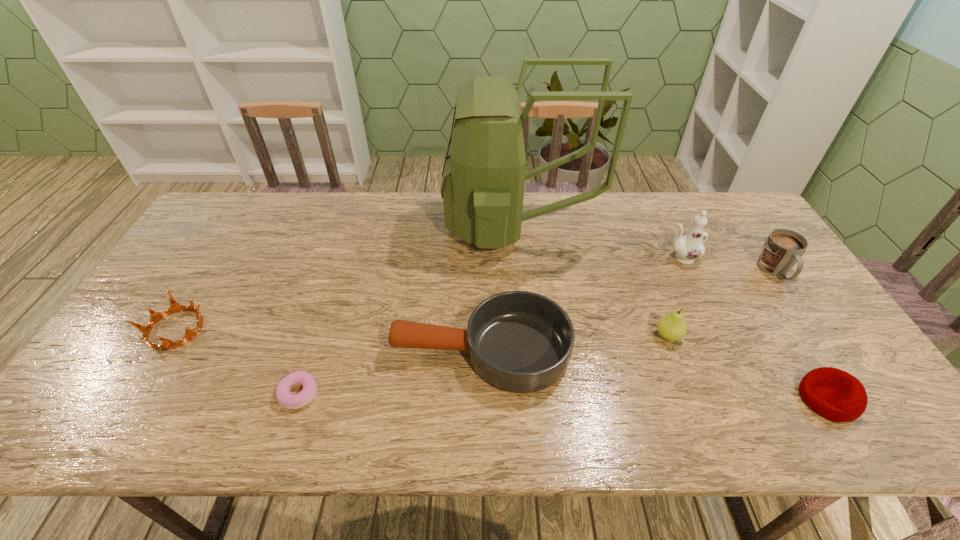
This screenshot has width=960, height=540. What are the coordinates of `mug present at the right edge` in the screenshot? It's located at (783, 248).

This screenshot has height=540, width=960. Find the location of `beanbag that is at the right edge`. beanbag that is at the right edge is located at coordinates click(836, 395).

The width and height of the screenshot is (960, 540). What are the coordinates of `object at the near right corner` in the screenshot? It's located at (836, 395).

This screenshot has height=540, width=960. Identify the location of vacant space at the far edge. (x=663, y=226).

Find the location of `blank space at the near edge of the desktop`. blank space at the near edge of the desktop is located at coordinates (336, 408).

Where is `free space at the left edge of the desktop`? Image resolution: width=960 pixels, height=540 pixels. free space at the left edge of the desktop is located at coordinates (167, 295).

In the image, there is a desktop. In order to click on vacant space at the far left corner in this screenshot , I will do `click(269, 192)`.

Locate an element on the screen. free space between the beanbag and the shortest object is located at coordinates (564, 396).

Identify the location of free space that is in between the pastry and the beanbag. (564, 396).

Locate an element on the screen. The width and height of the screenshot is (960, 540). free space between the tallest object and the fifth object from left to right is located at coordinates (592, 280).